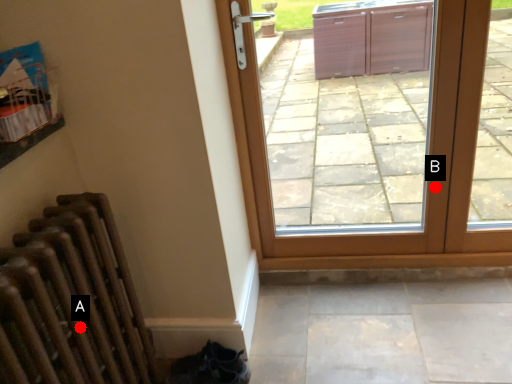
Question: Two points are circled on the image, labeled by A and B beside each circle. Which point is farther to the camera?

Choices:
 (A) A is further
 (B) B is further

Answer: (B)